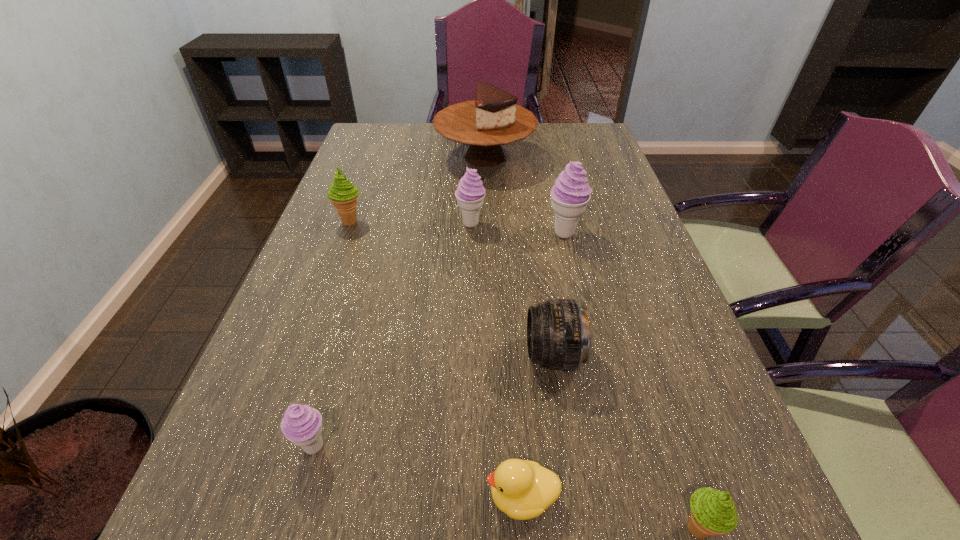
Identify the location of cake. (493, 119).

Find the location of `the farthest object`. the farthest object is located at coordinates (493, 119).

Locate an element on the screen. This screenshot has width=960, height=540. the biggest purple icecream is located at coordinates (571, 193).

At what (x,y) coordinates should I click in order to perform the action: click on the tallest icecream. Please return your answer as a coordinate pair (x, y). Image resolution: width=960 pixels, height=540 pixels. Looking at the image, I should click on coord(571,193).

Identify the location of the third icecream from right to left. (470, 193).

Locate an element on the screen. This screenshot has height=540, width=960. the second biggest purple icecream is located at coordinates (470, 193).

The height and width of the screenshot is (540, 960). I want to click on the farther green icecream, so click(x=342, y=193).

You are a GUI agent. You are given a task and a screenshot of the screen. Output one action in this format:
    pyautogui.click(x=<x>, y=<y>)
    Task: Click on the left green icecream
    The height and width of the screenshot is (540, 960).
    Given the screenshot: What is the action you would take?
    pyautogui.click(x=342, y=193)

Where is `the fifth farthest object`? the fifth farthest object is located at coordinates (558, 336).

Where is `the leftmost purple icecream`? the leftmost purple icecream is located at coordinates (302, 425).